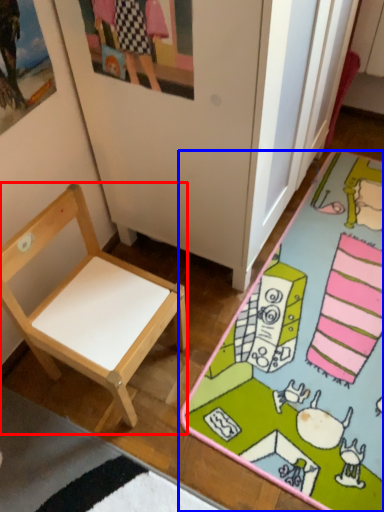
Question: Which object is further to the camera taking this photo, chair (highlighted by a red box) or desk (highlighted by a blue box)?

Choices:
 (A) chair
 (B) desk

Answer: (B)